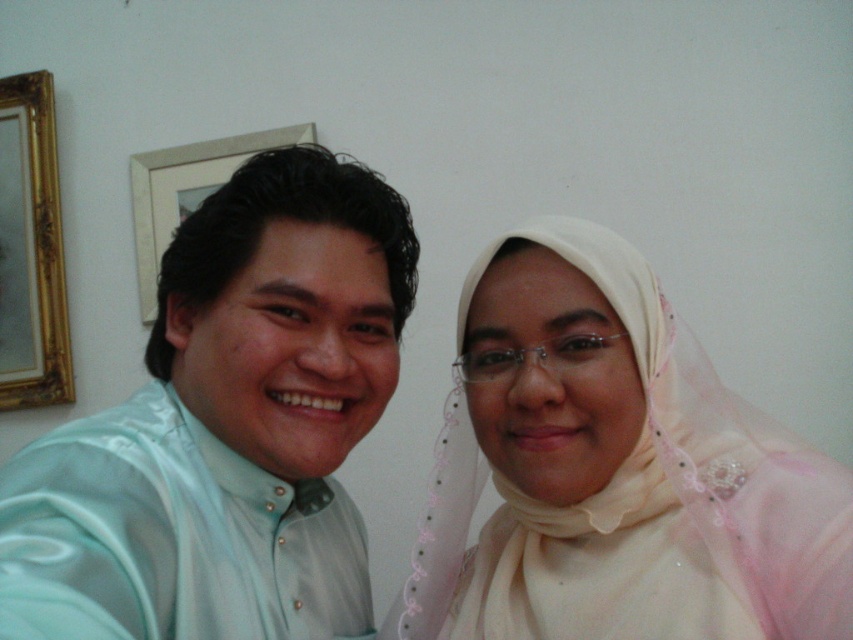
Looking at this image, you are standing in front of the photo and want to touch the points on the image. Which point is closer to you, point (509, 618) or point (165, 179)?

Point (509, 618) is closer to the viewer than point (165, 179).

You are a photographer setting up for a portrait session. You notice the light beige sheer hijab at center and the gold ornate mirror at upper left in the frame. Which object occupies more vertical space in the image?

The gold ornate mirror at upper left is taller than the light beige sheer hijab at center, so it occupies more vertical space.

You are a photographer setting up for a photoshoot. You have two items to place in the frame. The light blue satin shirt at left and the light beige sheer hijab at center. The client wants to know which item takes up more space in the photo. Which one should you point out?

The light blue satin shirt at left takes up more space in the photo because it is bigger than the light beige sheer hijab at center.